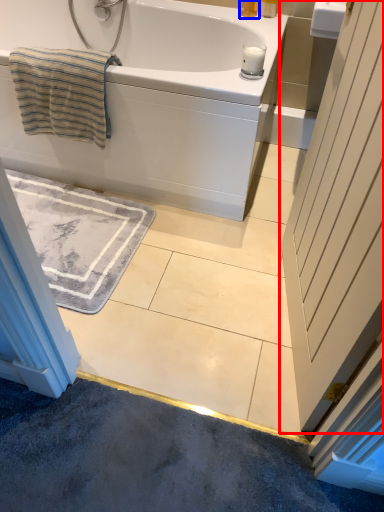
Question: Which of the following is the farthest to the observer, door (highlighted by a red box) or toiletry (highlighted by a blue box)?

Choices:
 (A) door
 (B) toiletry

Answer: (B)